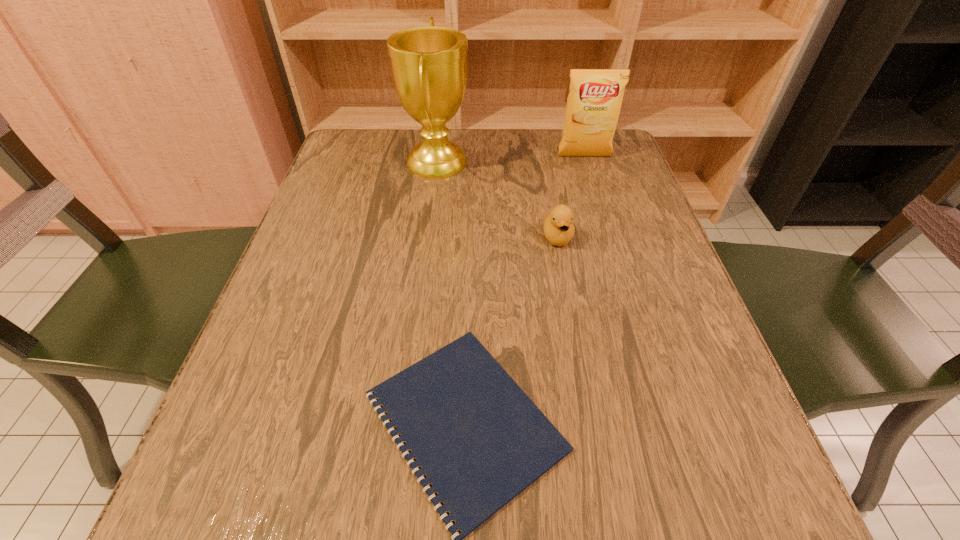
Where is `free spot between the crisp (potato chip) and the tallest object`? This screenshot has width=960, height=540. free spot between the crisp (potato chip) and the tallest object is located at coordinates pos(511,159).

Locate an element on the screen. Image resolution: width=960 pixels, height=540 pixels. the third closest object to the nearest object is located at coordinates coord(593,106).

Where is `the third closest object relative to the tallest object`? The height and width of the screenshot is (540, 960). the third closest object relative to the tallest object is located at coordinates (480, 440).